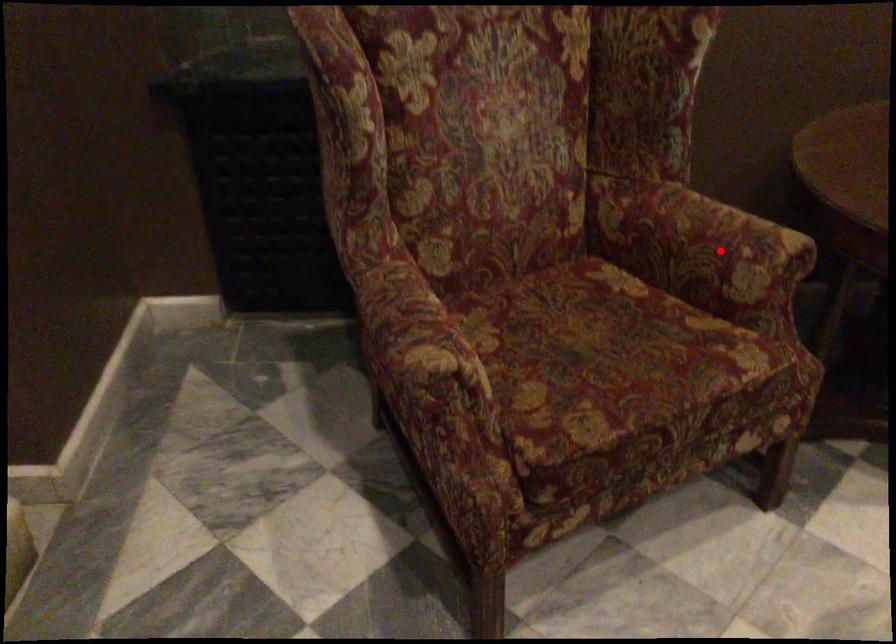
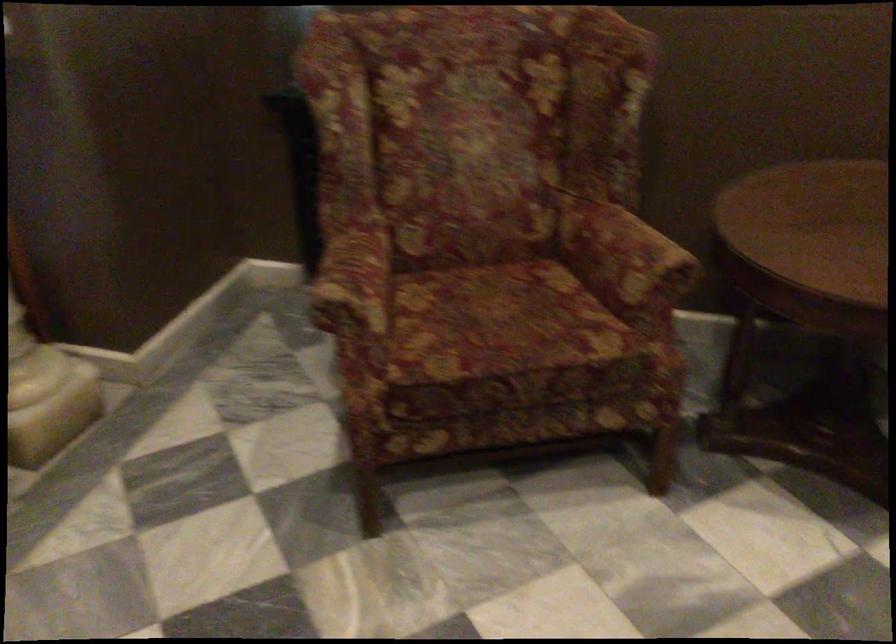
Locate, in the second image, the point that corresponds to the highlighted location in the first image.

(624, 258)